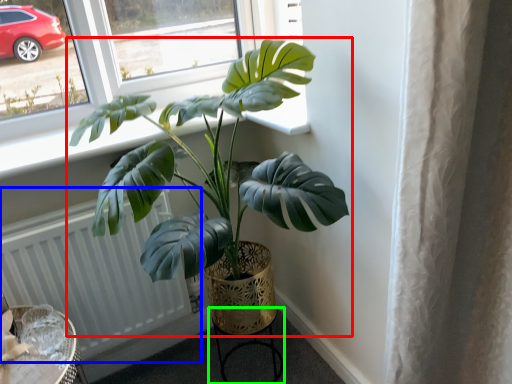
Question: Which object is the farthest from houseplant (highlighted by a red box)? Choose among these: radiator (highlighted by a blue box) or round table (highlighted by a green box).

Choices:
 (A) radiator
 (B) round table

Answer: (B)